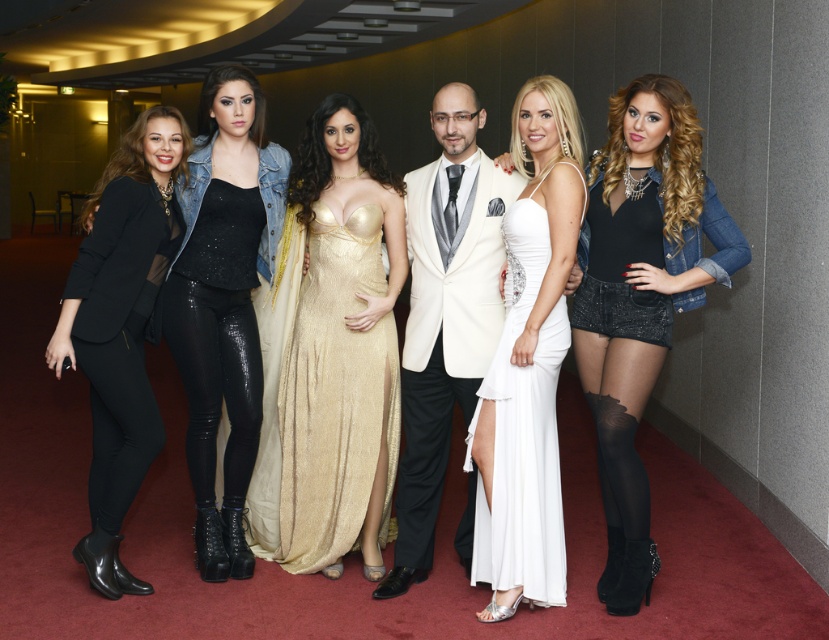
You are a photographer positioned at the end of the hallway. You need to capture a group photo of the white satin dress at center and the matte black blazer at left. The camera you are using has a minimum focus distance of 5 feet. Can you take the photo without moving either subject?

The distance between the white satin dress at center and the matte black blazer at left is 6.00 feet, which is greater than the camera minimum focus distance of 5 feet. Therefore, you can take the photo without moving either subject.

You are a photographer at a formal event. You need to capture a photo of the black sequined dress at center and the black leather pants at left. Which object should you focus on first if you want to highlight the larger one?

The black sequined dress at center has a larger size compared to the black leather pants at left, so you should focus on the black sequined dress at center first to highlight its larger size.